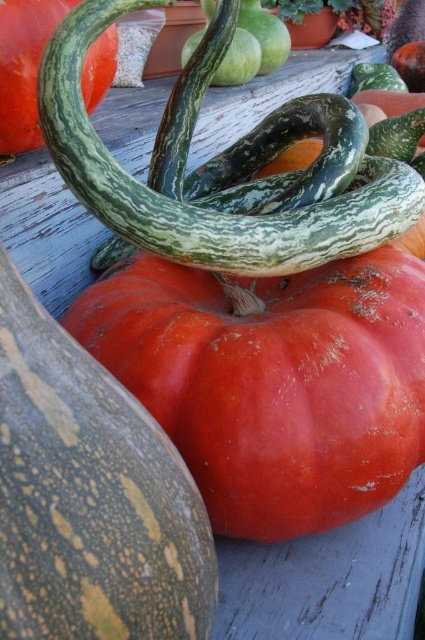
You are standing in front of the harvest display and want to place a small decoration between the two points, point (11, 412) and point (28, 132). Will the decoration be closer to the front or the back of the display?

The decoration placed between point (11, 412) and point (28, 132) will be closer to the front of the display because point (11, 412) is in front of point (28, 132).

You are standing in front of a harvest display. There is a large orange pumpkin at the center and a long green gourd on top of it. A point with coordinates (90, 497) is marked in the scene. Which object is this point located on?

The point with coordinates (90, 497) is located on the smooth orange pumpkin at center.

You are setting up a harvest display and need to stack items vertically. You have the smooth orange pumpkin at center and the green striped gourd at center. Which item should you place at the bottom of the stack to ensure stability?

The smooth orange pumpkin at center is taller than the green striped gourd at center, so placing the taller smooth orange pumpkin at center at the bottom will provide a stable base for the stack.